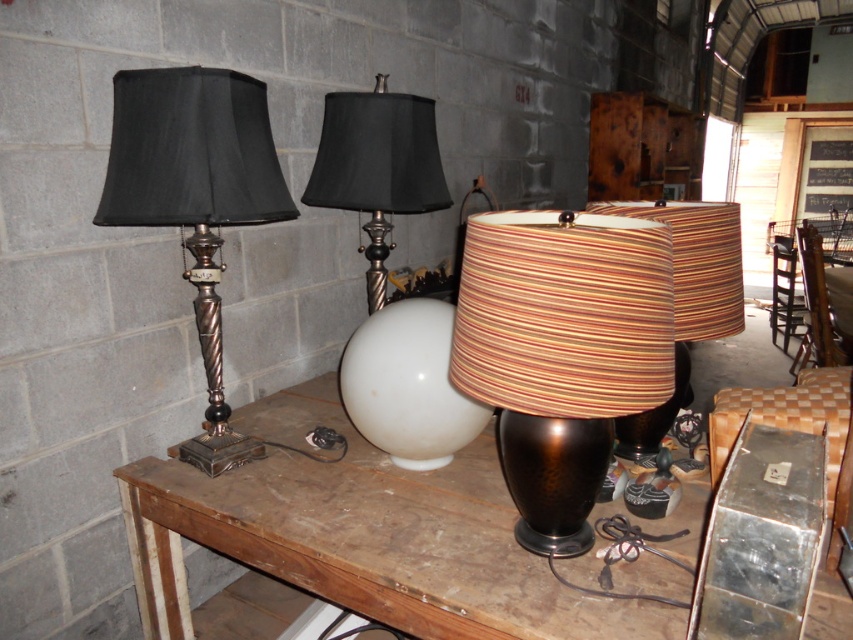
You are a delivery person who needs to place a small package between the brown wooden table at center and the white glossy sphere at center. The package is 10 inches long. Can you fit it between them without moving either object?

The distance between the brown wooden table at center and the white glossy sphere at center is 9.30 inches, which is shorter than the package length of 10 inches. Therefore, the package cannot fit between them without moving either object.

You are an interior designer arranging lamps on a table. You have a brown striped lampshade at center and a striped fabric lampshade at center. Which lampshade has a smaller width?

The brown striped lampshade at center has a lesser width compared to the striped fabric lampshade at center.

In the scene shown: You are standing in front of the gray brick wall and want to place a new lamp on the brown wooden table at center. Based on the coordinates provided, where exactly should you place the new lamp?

The brown wooden table at center is located at coordinates point (363, 536), so place the new lamp there.